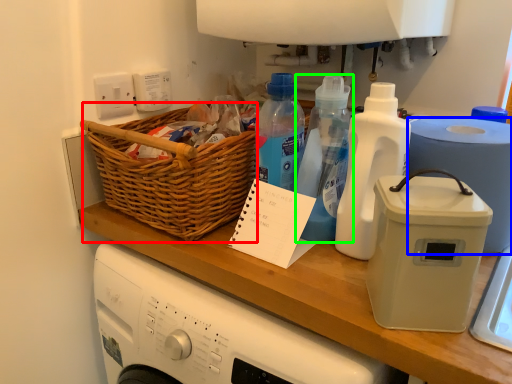
Question: Which object is positioned closest to basket (highlighted by a red box)? Select from paper towel (highlighted by a blue box) and bottle (highlighted by a green box).

Choices:
 (A) paper towel
 (B) bottle

Answer: (B)